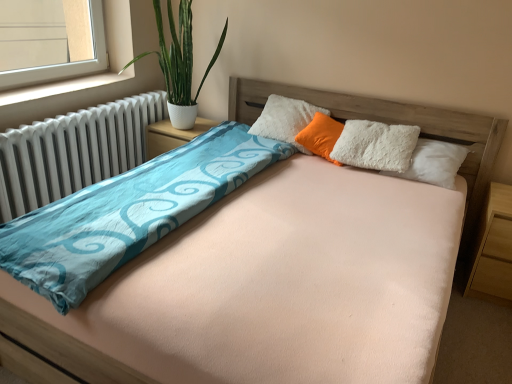
Question: From the image's perspective, is white textured nightstand at center, acting as the first nightstand starting from the back, on light brown wood at right, marked as the 1th nightstand in a bottom-to-top arrangement?

Choices:
 (A) no
 (B) yes

Answer: (B)

Question: From a real-world perspective, is white textured nightstand at center, which is the first nightstand in left-to-right order, under light brown wood at right, which is the second nightstand from left to right?

Choices:
 (A) yes
 (B) no

Answer: (B)

Question: Considering the relative sizes of white textured nightstand at center, arranged as the second nightstand when ordered from the bottom, and light brown wood at right, arranged as the 1th nightstand when viewed from the right, in the image provided, is white textured nightstand at center, arranged as the second nightstand when ordered from the bottom, smaller than light brown wood at right, arranged as the 1th nightstand when viewed from the right,?

Choices:
 (A) yes
 (B) no

Answer: (A)

Question: Are white textured nightstand at center, arranged as the second nightstand when ordered from the bottom, and light brown wood at right, marked as the 1th nightstand in a front-to-back arrangement, making contact?

Choices:
 (A) no
 (B) yes

Answer: (A)

Question: Is white textured nightstand at center, arranged as the 1th nightstand when viewed from the top, to the left of light brown wood at right, marked as the 1th nightstand in a front-to-back arrangement, from the viewer's perspective?

Choices:
 (A) yes
 (B) no

Answer: (A)

Question: From a real-world perspective, is green leafy plant in white pot at left above or below white plastic window sill at left?

Choices:
 (A) below
 (B) above

Answer: (B)

Question: From the image's perspective, relative to white plastic window sill at left, is green leafy plant in white pot at left above or below?

Choices:
 (A) below
 (B) above

Answer: (B)

Question: Is green leafy plant in white pot at left in front of or behind white plastic window sill at left in the image?

Choices:
 (A) front
 (B) behind

Answer: (B)

Question: Does point (172, 31) appear closer or farther from the camera than point (77, 87)?

Choices:
 (A) farther
 (B) closer

Answer: (A)

Question: In terms of height, does light brown wood at right, acting as the 2th nightstand starting from the back, look taller or shorter compared to green leafy plant in white pot at left?

Choices:
 (A) tall
 (B) short

Answer: (B)

Question: Would you say light brown wood at right, placed as the second nightstand when sorted from top to bottom, is to the left or to the right of green leafy plant in white pot at left in the picture?

Choices:
 (A) right
 (B) left

Answer: (A)

Question: In terms of width, does light brown wood at right, arranged as the 1th nightstand when viewed from the right, look wider or thinner when compared to green leafy plant in white pot at left?

Choices:
 (A) wide
 (B) thin

Answer: (B)

Question: Considering their positions, is light brown wood at right, arranged as the 1th nightstand when viewed from the right, located in front of or behind green leafy plant in white pot at left?

Choices:
 (A) front
 (B) behind

Answer: (A)

Question: Based on their positions, is white metallic radiator at left located to the left or right of light brown wood at right, which is the second nightstand from left to right?

Choices:
 (A) right
 (B) left

Answer: (B)

Question: Is point (34, 192) positioned closer to the camera than point (510, 288)?

Choices:
 (A) farther
 (B) closer

Answer: (A)